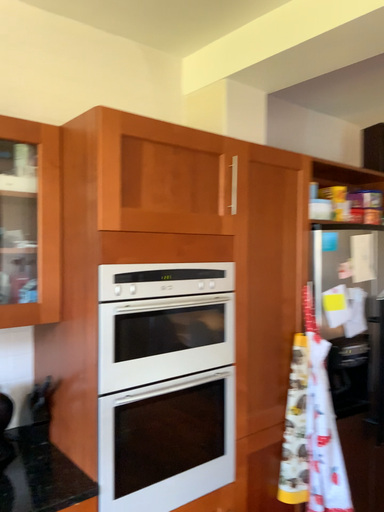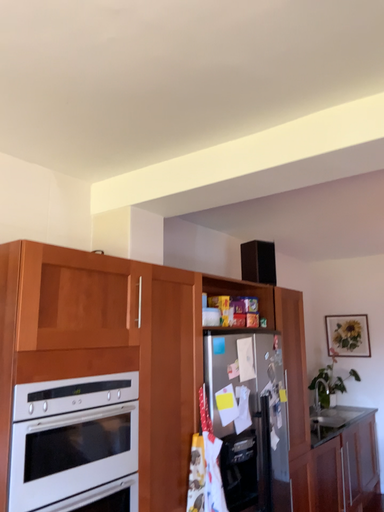
Question: How did the camera likely rotate when shooting the video?

Choices:
 (A) rotated left
 (B) rotated right

Answer: (B)